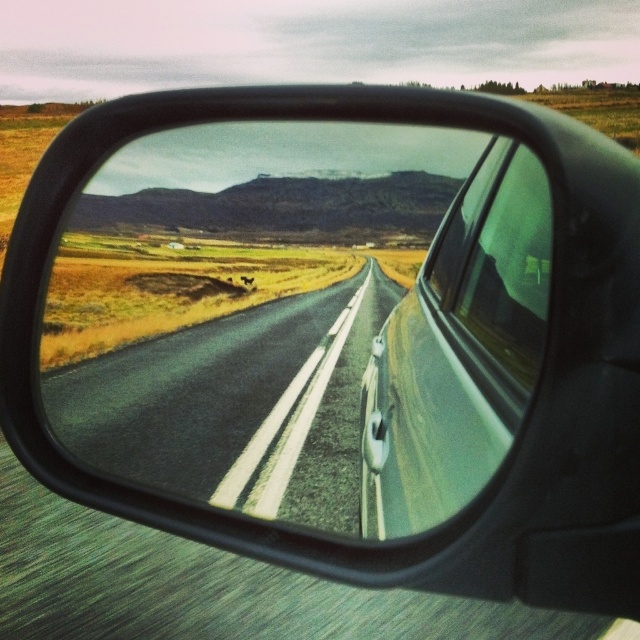
Does asphalt road at center appear under transparent glass car window at center?

Yes.

I want to click on asphalt road at center, so click(236, 404).

Based on the photo, who is positioned more to the right, black glossy mirror at center or transparent glass car window at center?

transparent glass car window at center is more to the right.

Which of these two, black glossy mirror at center or transparent glass car window at center, stands shorter?

transparent glass car window at center

The height and width of the screenshot is (640, 640). Identify the location of black glossy mirror at center. (301, 317).

I want to click on black glossy mirror at center, so click(x=301, y=317).

Can you confirm if black glossy mirror at center is positioned to the right of asphalt road at center?

No, black glossy mirror at center is not to the right of asphalt road at center.

Is black glossy mirror at center positioned behind asphalt road at center?

No, it is not.

Is point (102, 180) closer to camera compared to point (228, 397)?

Yes, it is in front of point (228, 397).

Locate an element on the screen. black glossy mirror at center is located at coordinates (301, 317).